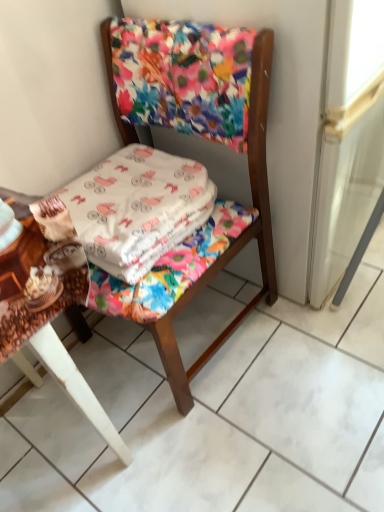
Question: Does wooden table at lower left have a lesser width compared to floral fabric screen door at upper center?

Choices:
 (A) no
 (B) yes

Answer: (B)

Question: Can you confirm if wooden table at lower left is shorter than floral fabric screen door at upper center?

Choices:
 (A) no
 (B) yes

Answer: (B)

Question: Is wooden table at lower left outside of floral fabric screen door at upper center?

Choices:
 (A) yes
 (B) no

Answer: (A)

Question: From the image's perspective, is wooden table at lower left above floral fabric screen door at upper center?

Choices:
 (A) no
 (B) yes

Answer: (A)

Question: Would you say floral fabric screen door at upper center is part of wooden table at lower left's contents?

Choices:
 (A) no
 (B) yes

Answer: (A)

Question: Considering the relative sizes of wooden table at lower left and floral fabric screen door at upper center in the image provided, is wooden table at lower left wider than floral fabric screen door at upper center?

Choices:
 (A) yes
 (B) no

Answer: (B)

Question: Is wooden table at lower left turned away from white cotton blanket at center?

Choices:
 (A) yes
 (B) no

Answer: (B)

Question: Is wooden table at lower left wider than white cotton blanket at center?

Choices:
 (A) yes
 (B) no

Answer: (A)

Question: Is wooden table at lower left bigger than white cotton blanket at center?

Choices:
 (A) yes
 (B) no

Answer: (A)

Question: From a real-world perspective, does wooden table at lower left sit lower than white cotton blanket at center?

Choices:
 (A) no
 (B) yes

Answer: (B)

Question: Considering the relative sizes of wooden table at lower left and white cotton blanket at center in the image provided, is wooden table at lower left taller than white cotton blanket at center?

Choices:
 (A) no
 (B) yes

Answer: (B)

Question: Is wooden table at lower left positioned in front of white cotton blanket at center?

Choices:
 (A) no
 (B) yes

Answer: (B)

Question: From a real-world perspective, does white cotton blanket at center sit lower than floral fabric chair at center?

Choices:
 (A) yes
 (B) no

Answer: (B)